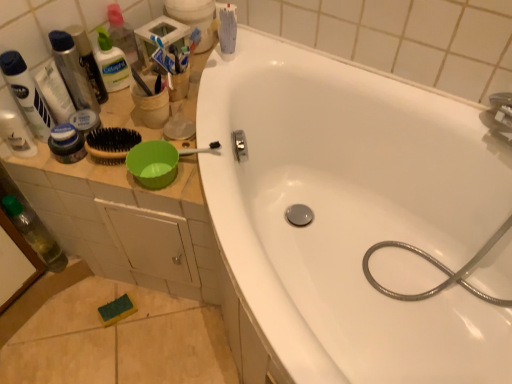
What are the coordinates of `vacant space in front of green matte mouthwash at upper left` in the screenshot? It's located at (113, 120).